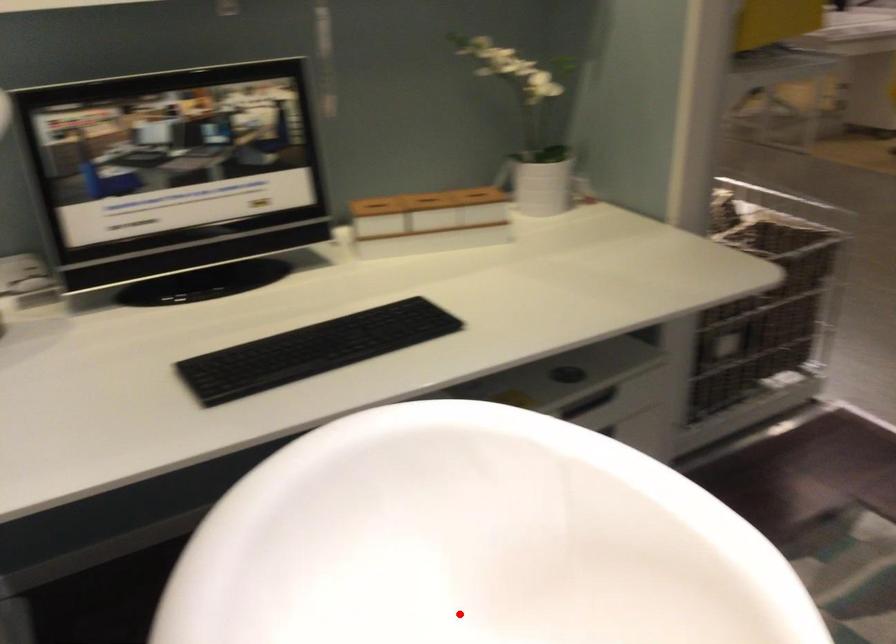
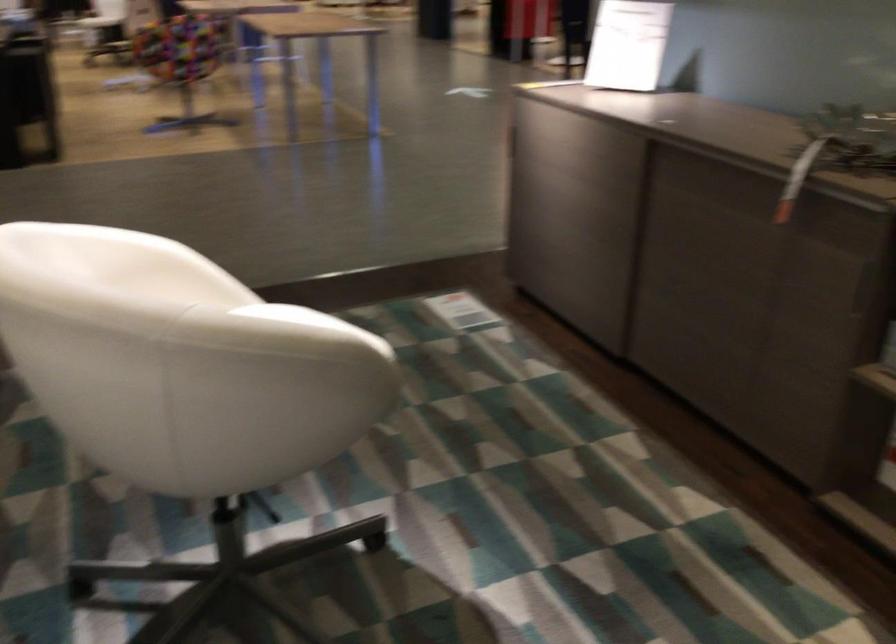
Question: I am providing you with two images of the same scene from different viewpoints. A red point is marked on the first image. Can you still see the location of the red point in image 2?

Choices:
 (A) Yes
 (B) No

Answer: (B)